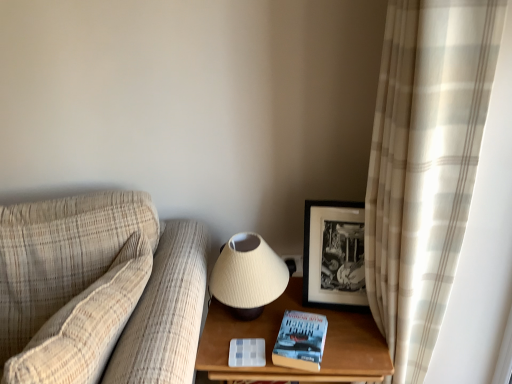
Find the location of a particular element. This screenshot has width=512, height=384. vacant point above wooden table at lower right (from a real-world perspective) is located at coordinates (294, 312).